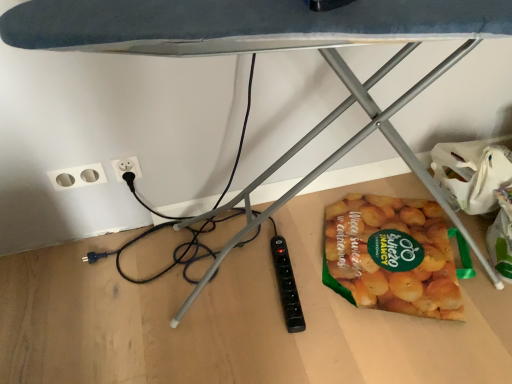
Where is `white plastic electric outlet at lower left`? white plastic electric outlet at lower left is located at coordinates (126, 167).

I want to click on white plastic socket at lower left, so click(x=77, y=176).

Between point (64, 189) and point (120, 175), which one is positioned behind?

The point (120, 175) is behind.

From the image's perspective, which is below, white plastic socket at lower left or white plastic electric outlet at lower left?

white plastic socket at lower left.

Could you tell me if white plastic socket at lower left is facing white plastic electric outlet at lower left?

No, white plastic socket at lower left is not turned towards white plastic electric outlet at lower left.

Relative to white plastic electric outlet at lower left, is white plastic socket at lower left in front or behind?

white plastic socket at lower left is positioned closer to the viewer than white plastic electric outlet at lower left.

Find the location of `socket above the translucent plastic bag of sliced potatoes at lower right (from the image's perspective)`. socket above the translucent plastic bag of sliced potatoes at lower right (from the image's perspective) is located at coordinates (77, 176).

Does white plastic socket at lower left come in front of translucent plastic bag of sliced potatoes at lower right?

No, white plastic socket at lower left is further to the viewer.

From the image's perspective, which is below, white plastic socket at lower left or translucent plastic bag of sliced potatoes at lower right?

translucent plastic bag of sliced potatoes at lower right.

Does white plastic socket at lower left touch translucent plastic bag of sliced potatoes at lower right?

No, white plastic socket at lower left is not making contact with translucent plastic bag of sliced potatoes at lower right.

Considering the sizes of objects white plastic electric outlet at lower left and translucent plastic bag of sliced potatoes at lower right in the image provided, who is bigger, white plastic electric outlet at lower left or translucent plastic bag of sliced potatoes at lower right?

translucent plastic bag of sliced potatoes at lower right is bigger.

From the image's perspective, is white plastic electric outlet at lower left below translucent plastic bag of sliced potatoes at lower right?

Incorrect, from the image's perspective, white plastic electric outlet at lower left is higher than translucent plastic bag of sliced potatoes at lower right.

This screenshot has height=384, width=512. Identify the location of snack in front of the white plastic electric outlet at lower left. (387, 270).

Is point (132, 170) closer or farther from the camera than point (379, 278)?

Point (132, 170) is farther from the camera than point (379, 278).

Is point (119, 174) positioned behind point (77, 183)?

That is True.

Considering the positions of objects white plastic electric outlet at lower left and white plastic socket at lower left in the image provided, who is more to the left, white plastic electric outlet at lower left or white plastic socket at lower left?

white plastic socket at lower left is more to the left.

Is white plastic electric outlet at lower left next to white plastic socket at lower left and touching it?

Indeed, white plastic electric outlet at lower left and white plastic socket at lower left are beside each other and touching.

Is translucent plastic bag of sliced potatoes at lower right not close to white plastic electric outlet at lower left?

No, translucent plastic bag of sliced potatoes at lower right is not far away from white plastic electric outlet at lower left.

Is translucent plastic bag of sliced potatoes at lower right behind white plastic electric outlet at lower left?

No, translucent plastic bag of sliced potatoes at lower right is closer to the viewer.

Is translucent plastic bag of sliced potatoes at lower right oriented towards white plastic electric outlet at lower left?

No, translucent plastic bag of sliced potatoes at lower right is not oriented towards white plastic electric outlet at lower left.

Can we say translucent plastic bag of sliced potatoes at lower right lies outside white plastic electric outlet at lower left?

Yes.

Identify the location of snack beneath the white plastic socket at lower left (from a real-world perspective). (387, 270).

From a real-world perspective, is translucent plastic bag of sliced potatoes at lower right over white plastic socket at lower left?

Incorrect, from a real-world perspective, translucent plastic bag of sliced potatoes at lower right is lower than white plastic socket at lower left.

Is translucent plastic bag of sliced potatoes at lower right positioned far away from white plastic socket at lower left?

No.

Is the depth of translucent plastic bag of sliced potatoes at lower right less than that of white plastic socket at lower left?

That is True.

At what (x,y) coordinates should I click in order to perform the action: click on electric outlet behind the white plastic socket at lower left. Please return your answer as a coordinate pair (x, y). The image size is (512, 384). Looking at the image, I should click on (126, 167).

Identify the location of snack below the white plastic socket at lower left (from the image's perspective). (387, 270).

From the image, which object appears to be farther from white plastic electric outlet at lower left, translucent plastic bag of sliced potatoes at lower right or white plastic socket at lower left?

Among the two, translucent plastic bag of sliced potatoes at lower right is located further to white plastic electric outlet at lower left.

Looking at this image, considering their positions, is white plastic electric outlet at lower left positioned closer to white plastic socket at lower left than translucent plastic bag of sliced potatoes at lower right?

Based on the image, white plastic electric outlet at lower left appears to be nearer to white plastic socket at lower left.

Which object lies further to the anchor point translucent plastic bag of sliced potatoes at lower right, white plastic electric outlet at lower left or white plastic socket at lower left?

Among the two, white plastic socket at lower left is located further to translucent plastic bag of sliced potatoes at lower right.

From the image, which object appears to be farther from white plastic electric outlet at lower left, white plastic socket at lower left or translucent plastic bag of sliced potatoes at lower right?

The object further to white plastic electric outlet at lower left is translucent plastic bag of sliced potatoes at lower right.

Estimate the real-world distances between objects in this image. Which object is closer to white plastic socket at lower left, translucent plastic bag of sliced potatoes at lower right or white plastic electric outlet at lower left?

white plastic electric outlet at lower left lies closer to white plastic socket at lower left than the other object.

Looking at the image, which one is located further to translucent plastic bag of sliced potatoes at lower right, white plastic socket at lower left or white plastic electric outlet at lower left?

Among the two, white plastic socket at lower left is located further to translucent plastic bag of sliced potatoes at lower right.

This screenshot has width=512, height=384. Find the location of `electric outlet between white plastic socket at lower left and translucent plastic bag of sliced potatoes at lower right in the horizontal direction`. electric outlet between white plastic socket at lower left and translucent plastic bag of sliced potatoes at lower right in the horizontal direction is located at coordinates (126, 167).